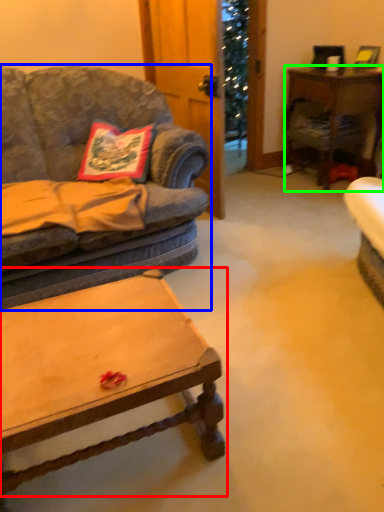
Question: Based on their relative distances, which object is farther from coffee table (highlighted by a red box)? Choose from studio couch (highlighted by a blue box) and desk (highlighted by a green box).

Choices:
 (A) studio couch
 (B) desk

Answer: (B)